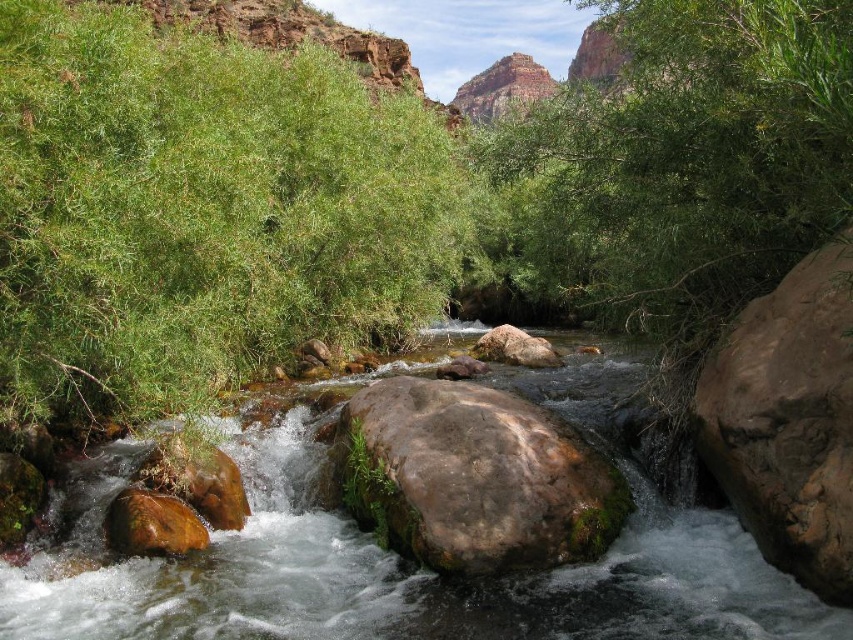
Question: Does green leafy shrubs at left appear on the left side of brown rough rock at right?

Choices:
 (A) no
 (B) yes

Answer: (B)

Question: Can you confirm if green leafy shrubs at left is positioned to the right of clear water at center?

Choices:
 (A) yes
 (B) no

Answer: (B)

Question: Can you confirm if clear water at center is positioned below brown rough rock at right?

Choices:
 (A) no
 (B) yes

Answer: (B)

Question: Among these points, which one is nearest to the camera?

Choices:
 (A) (64, 106)
 (B) (834, 380)
 (C) (549, 364)
 (D) (355, 468)

Answer: (B)

Question: Estimate the real-world distances between objects in this image. Which object is farther from the brown rough rock at center?

Choices:
 (A) green leafy shrubs at left
 (B) brown rough rock at right
 (C) green mossy rock at center

Answer: (B)

Question: Which of the following is the farthest from the observer?

Choices:
 (A) green leafy shrubs at left
 (B) green mossy rock at center
 (C) clear water at center

Answer: (A)